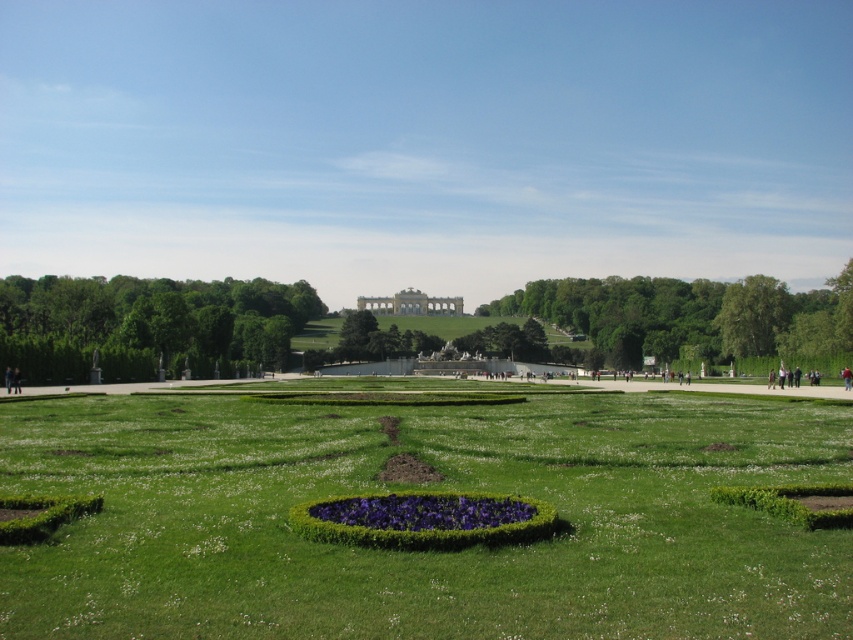
You are a gardener who needs to mow the lawn. You see the green grass at center and the purple matte flower bed at center. Which area should you avoid mowing to prevent damaging the plants?

You should avoid mowing the purple matte flower bed at center because it is shorter than the green grass at center, indicating it is a flower bed and not meant for mowing.

You are a gardener planning to install a new sprinkler system in the garden. The sprinkler has a maximum range of 50 feet. If you place the sprinkler at the green grass at center, will it be able to water the purple matte flower bed at center?

The green grass at center is 53.78 feet from the purple matte flower bed at center. Since the sprinkler has a maximum range of 50 feet, it cannot reach the purple matte flower bed at center from that position.